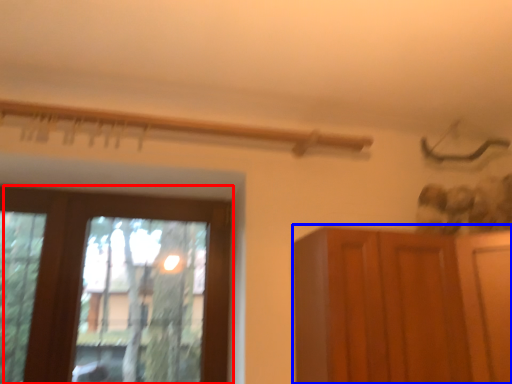
Question: Which object appears farthest to the camera in this image, window (highlighted by a red box) or cupboard (highlighted by a blue box)?

Choices:
 (A) window
 (B) cupboard

Answer: (A)